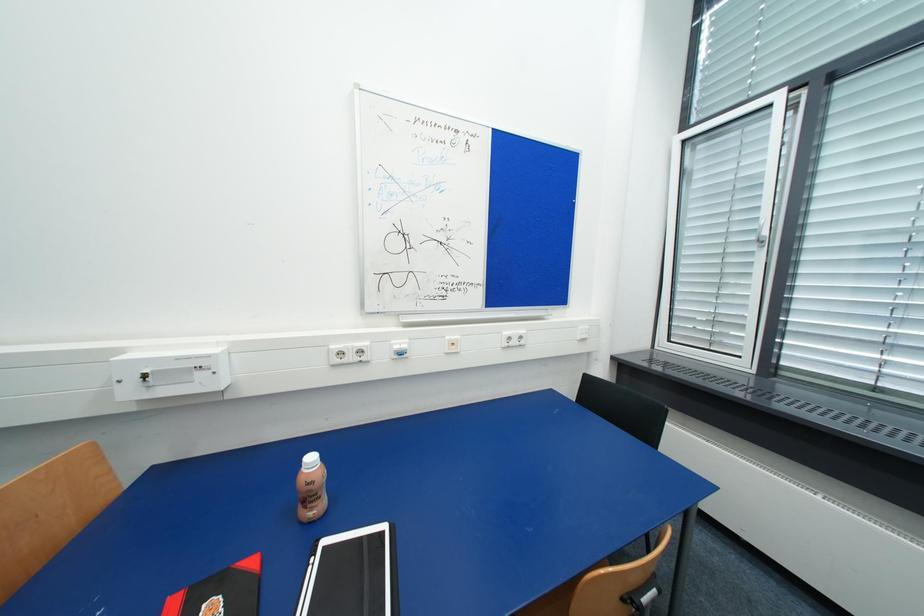
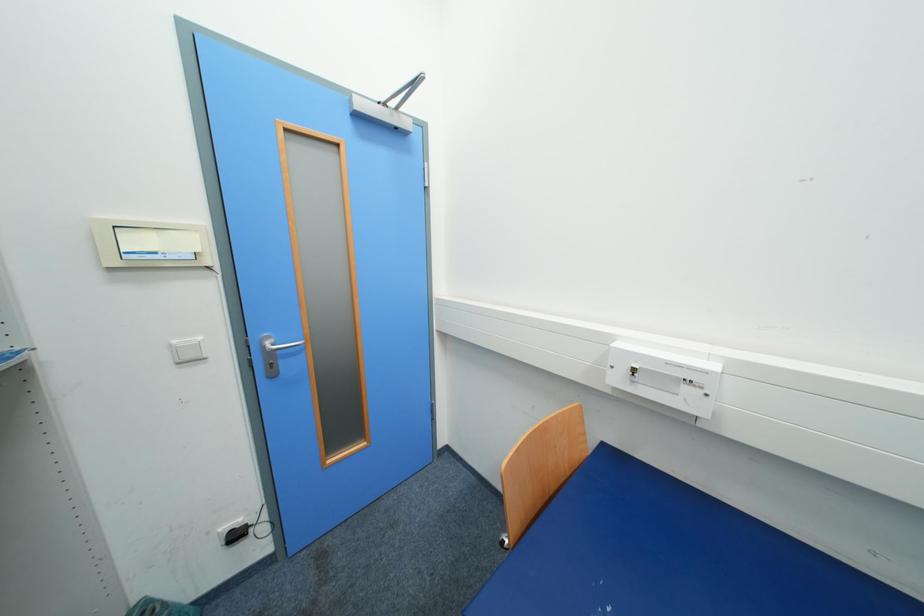
Question: Based on the continuous images, in which direction is the camera rotating? Reply with the corresponding letter.

Choices:
 (A) Left
 (B) Right
 (C) Up
 (D) Down

Answer: (A)